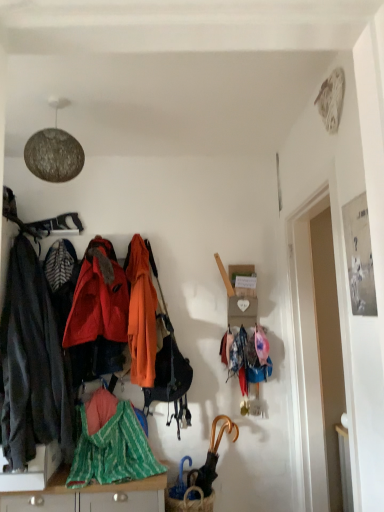
Question: Can you confirm if dark gray fabric jacket at left, which is counted as the 1th jacket, starting from the left, is shorter than orange matte handbag at center?

Choices:
 (A) yes
 (B) no

Answer: (B)

Question: From a real-world perspective, is dark gray fabric jacket at left, which is counted as the 1th jacket, starting from the left, positioned under orange matte handbag at center based on gravity?

Choices:
 (A) yes
 (B) no

Answer: (B)

Question: Is dark gray fabric jacket at left, which is counted as the 1th jacket, starting from the left, positioned with its back to orange matte handbag at center?

Choices:
 (A) yes
 (B) no

Answer: (B)

Question: Can you confirm if dark gray fabric jacket at left, the third jacket positioned from the right, is positioned to the right of orange matte handbag at center?

Choices:
 (A) yes
 (B) no

Answer: (B)

Question: Considering the relative positions of dark gray fabric jacket at left, the third jacket positioned from the right, and orange matte handbag at center in the image provided, is dark gray fabric jacket at left, the third jacket positioned from the right, behind orange matte handbag at center?

Choices:
 (A) no
 (B) yes

Answer: (A)

Question: Would you say dark gray fabric jacket at left, which is counted as the 1th jacket, starting from the left, contains orange matte handbag at center?

Choices:
 (A) yes
 (B) no

Answer: (B)

Question: From a real-world perspective, does green striped fabric at lower center stand above shiny red jacket at center, arranged as the 2th jacket when viewed from the left?

Choices:
 (A) no
 (B) yes

Answer: (A)

Question: Does green striped fabric at lower center contain shiny red jacket at center, which is the second jacket from right to left?

Choices:
 (A) yes
 (B) no

Answer: (B)

Question: Is green striped fabric at lower center further to the viewer compared to shiny red jacket at center, which is the second jacket from right to left?

Choices:
 (A) no
 (B) yes

Answer: (A)

Question: Does green striped fabric at lower center have a larger size compared to shiny red jacket at center, which is the second jacket from right to left?

Choices:
 (A) yes
 (B) no

Answer: (B)

Question: Does green striped fabric at lower center lie in front of shiny red jacket at center, which is the second jacket from right to left?

Choices:
 (A) no
 (B) yes

Answer: (B)

Question: Is green striped fabric at lower center to the left of shiny red jacket at center, arranged as the 2th jacket when viewed from the left, from the viewer's perspective?

Choices:
 (A) yes
 (B) no

Answer: (B)

Question: Could you tell me if dark gray fabric jacket at left, which is counted as the 1th jacket, starting from the left, is turned towards green striped fabric at lower center?

Choices:
 (A) no
 (B) yes

Answer: (A)